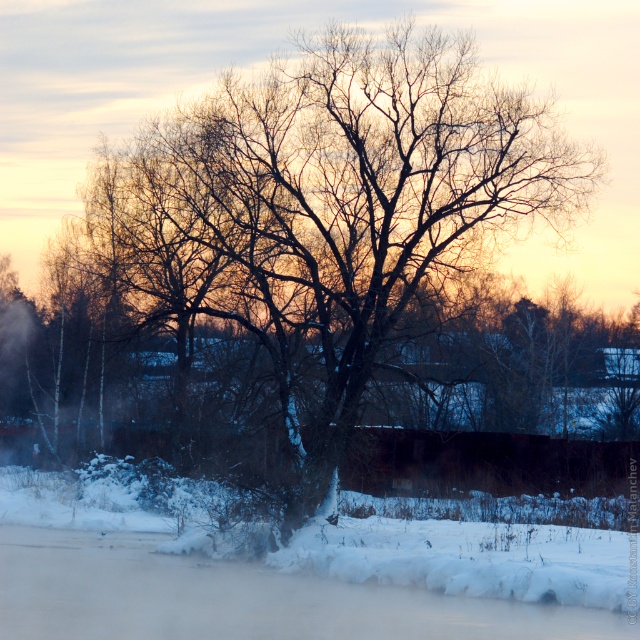
Question: Does bare branches at center appear over white fluffy snow at lower center?

Choices:
 (A) no
 (B) yes

Answer: (B)

Question: Does bare branches at center appear on the right side of white fluffy snow at lower center?

Choices:
 (A) no
 (B) yes

Answer: (B)

Question: Which object appears farthest from the camera in this image?

Choices:
 (A) white fluffy snow at lower center
 (B) bare branches at center

Answer: (B)

Question: Is bare branches at center below white fluffy snow at lower center?

Choices:
 (A) yes
 (B) no

Answer: (B)

Question: Which point appears closest to the camera in this image?

Choices:
 (A) (237, 100)
 (B) (276, 604)

Answer: (B)